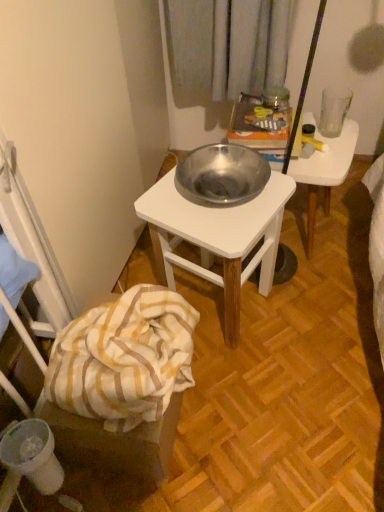
The image size is (384, 512). Find the location of `vacant space to the right of metallic white table at center`. vacant space to the right of metallic white table at center is located at coordinates (314, 313).